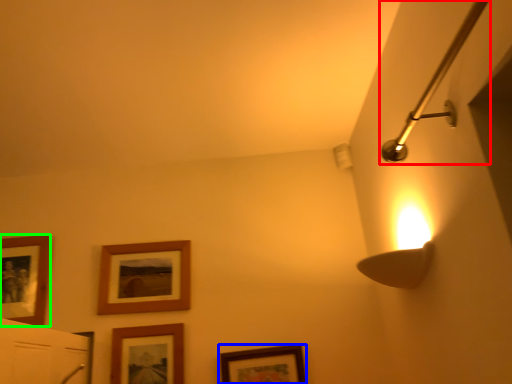
Question: Estimate the real-world distances between objects in this image. Which object is closer to shower (highlighted by a red box), picture frame (highlighted by a blue box) or picture frame (highlighted by a green box)?

Choices:
 (A) picture frame
 (B) picture frame

Answer: (A)